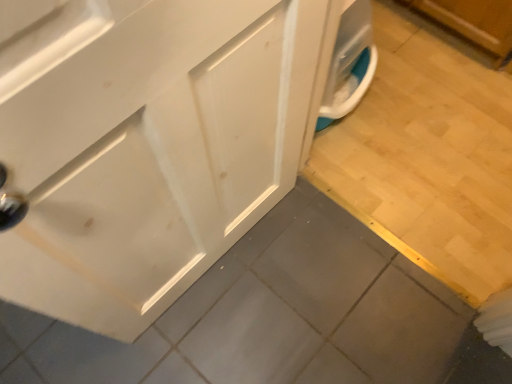
Question: Looking at the image, does white glossy cabinet at center seem bigger or smaller compared to wooden tile at lower right?

Choices:
 (A) small
 (B) big

Answer: (B)

Question: From a real-world perspective, is white glossy cabinet at center above or below wooden tile at lower right?

Choices:
 (A) below
 (B) above

Answer: (B)

Question: Which is correct: white glossy cabinet at center is inside wooden tile at lower right, or outside of it?

Choices:
 (A) inside
 (B) outside

Answer: (B)

Question: In terms of width, does wooden tile at lower right look wider or thinner when compared to white glossy cabinet at center?

Choices:
 (A) wide
 (B) thin

Answer: (A)

Question: From the image's perspective, is wooden tile at lower right positioned above or below white glossy cabinet at center?

Choices:
 (A) below
 (B) above

Answer: (B)

Question: Is wooden tile at lower right in front of or behind white glossy cabinet at center in the image?

Choices:
 (A) behind
 (B) front

Answer: (A)

Question: Is wooden tile at lower right inside the boundaries of white glossy cabinet at center, or outside?

Choices:
 (A) outside
 (B) inside

Answer: (A)